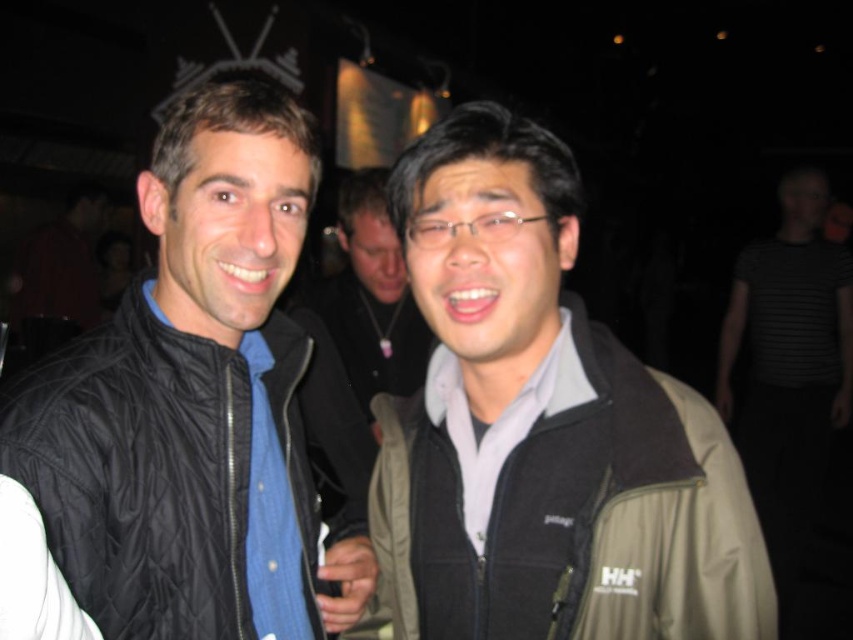
You are at the point labeled point (221, 136) and want to walk to the point labeled point (808, 449). Which direction should you move to get closer to your destination?

To move from point (221, 136) to point (808, 449), you should move towards the right and downward since point (808, 449) is located to the right and below point (221, 136).

You are a photographer at a social event. You want to take a group photo of the black striped shirt at right and matte gray jacket at center. The minimum distance required between subjects for your camera to focus properly is 8 feet. Can you take the photo with them standing as they are?

The distance between the black striped shirt at right and matte gray jacket at center is 7.31 feet, which is less than the required 8 feet. Therefore, the camera may not focus properly, so it is not advisable to take the photo with them in their current positions.

In the scene shown: You are a photographer trying to capture a clear shot of the black quilted vest at left. Based on its position, what are the coordinates you should focus on?

The black quilted vest at left is located at point (194, 401), so you should focus your camera on those coordinates to capture it clearly.